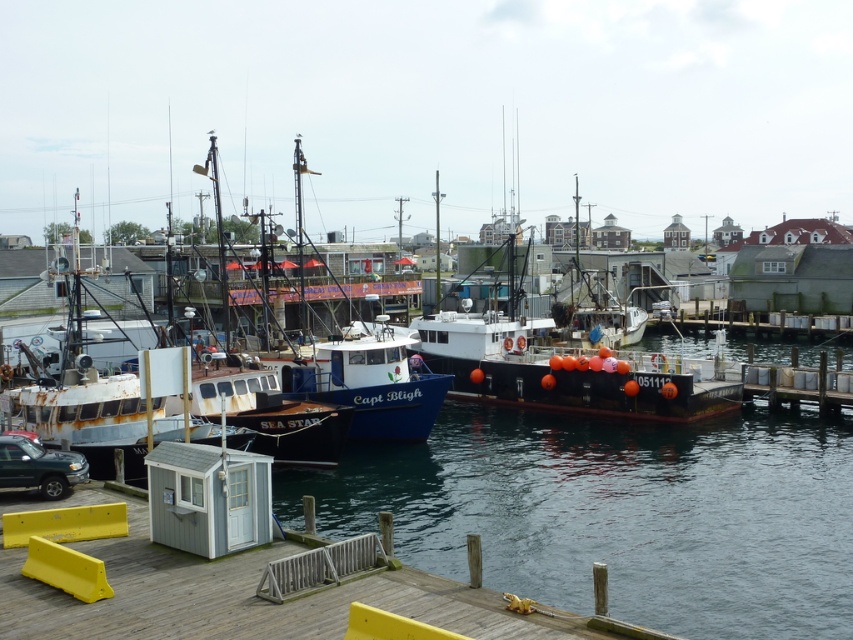
Question: Does wooden dock at lower left appear under black matte boat at center?

Choices:
 (A) yes
 (B) no

Answer: (A)

Question: Which object is farther from the camera taking this photo?

Choices:
 (A) wooden dock at lower left
 (B) black matte boat at center

Answer: (B)

Question: Is wooden dock at lower left bigger than black matte boat at center?

Choices:
 (A) yes
 (B) no

Answer: (B)

Question: Which of these objects is positioned closest to the wooden dock at lower left?

Choices:
 (A) metallic green truck at lower left
 (B) black matte boat at center

Answer: (A)

Question: Which point is closer to the camera taking this photo?

Choices:
 (A) (102, 490)
 (B) (531, 346)
 (C) (70, 467)

Answer: (C)

Question: Is wooden dock at lower left bigger than black matte boat at center?

Choices:
 (A) yes
 (B) no

Answer: (B)